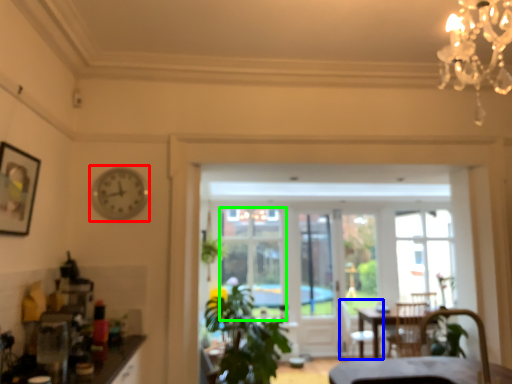
Question: Considering the real-world distances, which object is farthest from clock (highlighted by a red box)? armchair (highlighted by a blue box) or window (highlighted by a green box)?

Choices:
 (A) armchair
 (B) window

Answer: (A)